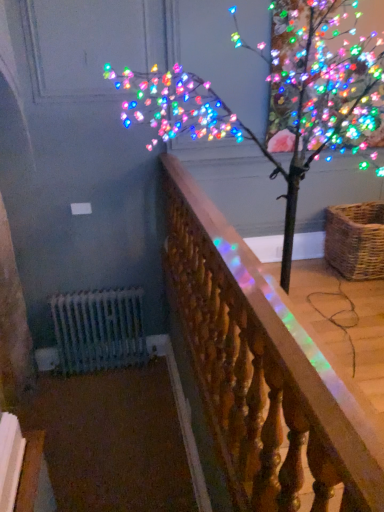
Question: In the image, is iridescent wood railing at center positioned in front of or behind woven brown basket at right?

Choices:
 (A) behind
 (B) front

Answer: (B)

Question: Is iridescent wood railing at center inside or outside of woven brown basket at right?

Choices:
 (A) outside
 (B) inside

Answer: (A)

Question: In terms of size, does iridescent wood railing at center appear bigger or smaller than woven brown basket at right?

Choices:
 (A) small
 (B) big

Answer: (B)

Question: From a real-world perspective, is woven brown basket at right positioned above or below iridescent wood railing at center?

Choices:
 (A) above
 (B) below

Answer: (B)

Question: Considering the positions of woven brown basket at right and iridescent wood railing at center in the image, is woven brown basket at right wider or thinner than iridescent wood railing at center?

Choices:
 (A) wide
 (B) thin

Answer: (A)

Question: In terms of height, does woven brown basket at right look taller or shorter compared to iridescent wood railing at center?

Choices:
 (A) tall
 (B) short

Answer: (B)

Question: In terms of size, does woven brown basket at right appear bigger or smaller than iridescent wood railing at center?

Choices:
 (A) big
 (B) small

Answer: (B)